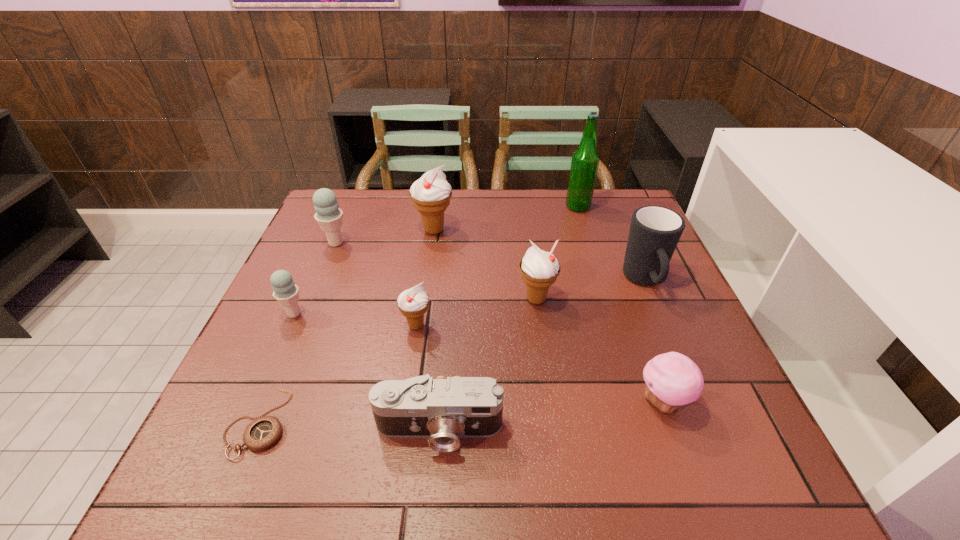
The image size is (960, 540). I want to click on blank space located 0.170m on the back of the nearer blue ice cream, so click(x=318, y=260).

The height and width of the screenshot is (540, 960). Find the location of `free space located on the front of the smallest white icecream`. free space located on the front of the smallest white icecream is located at coordinates (393, 483).

Where is `free point located 0.050m on the back of the cupcake`? The height and width of the screenshot is (540, 960). free point located 0.050m on the back of the cupcake is located at coordinates (648, 360).

The width and height of the screenshot is (960, 540). Identify the location of vacant region located on the right of the pocket watch. (330, 422).

In order to click on beer bottle that is at the far edge in this screenshot , I will do `click(585, 160)`.

At what (x,y) coordinates should I click in order to perform the action: click on icecream that is at the far edge. Please return your answer as a coordinate pair (x, y). The width and height of the screenshot is (960, 540). Looking at the image, I should click on (431, 194).

The height and width of the screenshot is (540, 960). What are the coordinates of `camera present at the near edge` in the screenshot? It's located at (443, 410).

This screenshot has height=540, width=960. In order to click on pocket watch that is positioned at the near edge in this screenshot , I will do `click(263, 432)`.

The height and width of the screenshot is (540, 960). Find the location of `pocket watch situated at the left edge`. pocket watch situated at the left edge is located at coordinates (263, 432).

Image resolution: width=960 pixels, height=540 pixels. I want to click on beer bottle situated at the right edge, so click(585, 160).